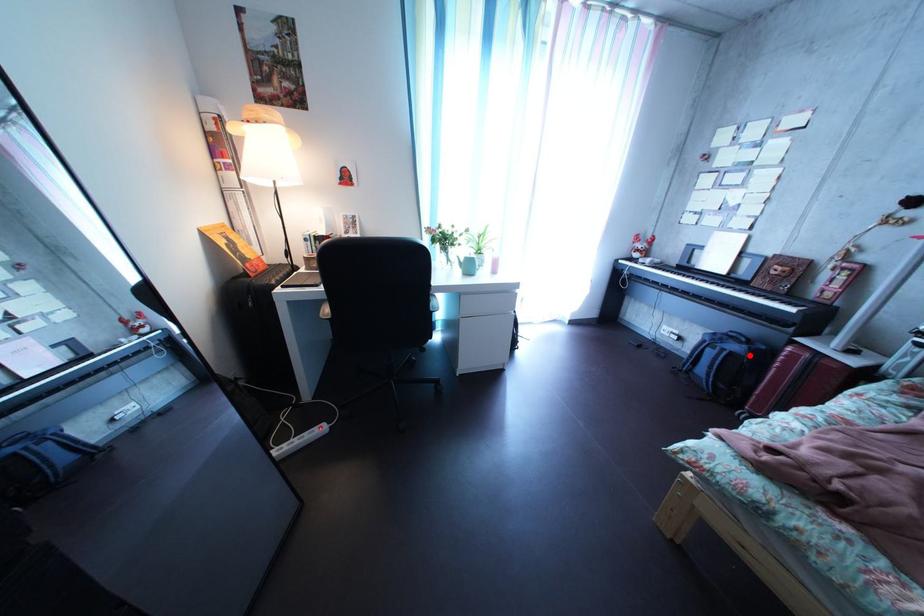
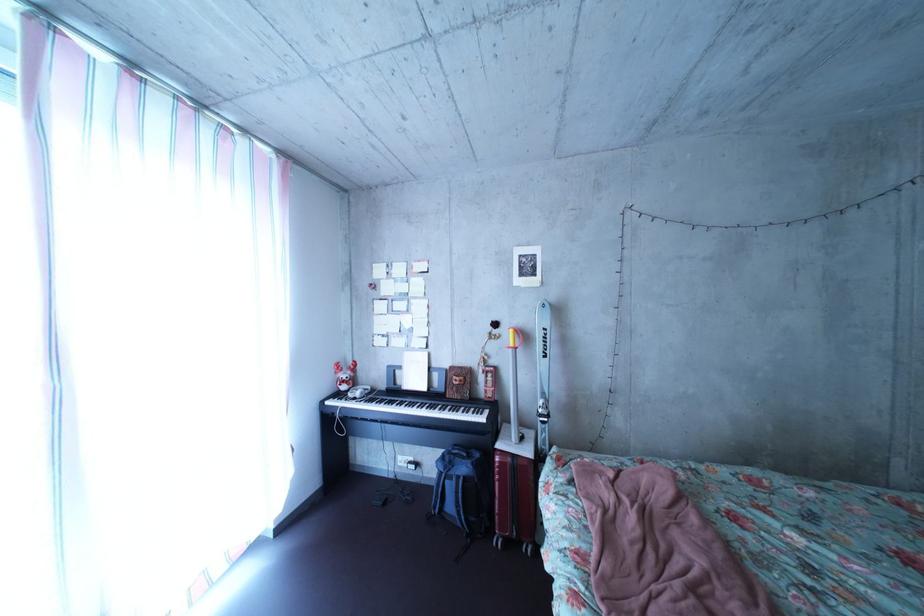
Question: I am providing you with two images of the same scene from different viewpoints. A red point is marked on the first image. Can you still see the location of the red point in image 2?

Choices:
 (A) Yes
 (B) No

Answer: (A)